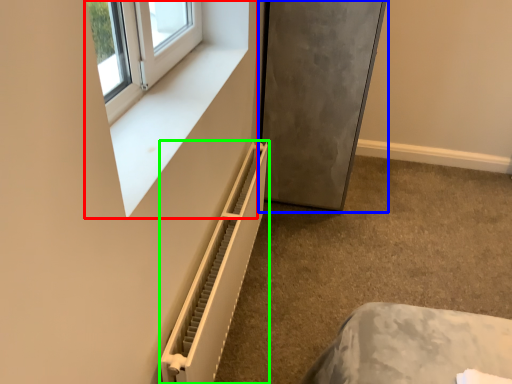
Question: Which object is positioned farthest from window frame (highlighted by a red box)? Select from fridge (highlighted by a blue box) and radiator (highlighted by a green box).

Choices:
 (A) fridge
 (B) radiator

Answer: (A)